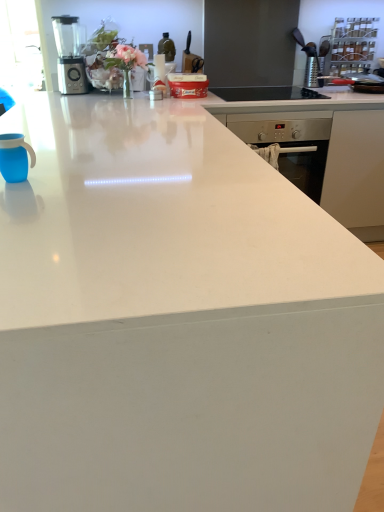
This screenshot has width=384, height=512. I want to click on free point in front of blue matte mug at left, so click(x=20, y=194).